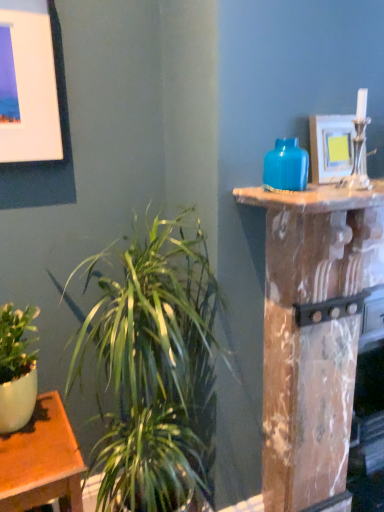
Question: Considering the relative sizes of matte white picture frame at upper left, the first picture frame from the left, and matte blue vase at upper right in the image provided, is matte white picture frame at upper left, the first picture frame from the left, shorter than matte blue vase at upper right?

Choices:
 (A) no
 (B) yes

Answer: (A)

Question: Considering the relative sizes of matte white picture frame at upper left, the first picture frame from the left, and matte blue vase at upper right in the image provided, is matte white picture frame at upper left, the first picture frame from the left, wider than matte blue vase at upper right?

Choices:
 (A) no
 (B) yes

Answer: (A)

Question: From the image's perspective, is matte white picture frame at upper left, the first picture frame from the left, located above matte blue vase at upper right?

Choices:
 (A) no
 (B) yes

Answer: (B)

Question: Is matte white picture frame at upper left, which is the 2th picture frame in right-to-left order, at the left side of matte blue vase at upper right?

Choices:
 (A) no
 (B) yes

Answer: (B)

Question: Is matte white picture frame at upper left, the first picture frame from the left, beside matte blue vase at upper right?

Choices:
 (A) no
 (B) yes

Answer: (A)

Question: Is matte white picture frame at upper left, the first picture frame from the left, positioned with its back to matte blue vase at upper right?

Choices:
 (A) yes
 (B) no

Answer: (B)

Question: Is matte blue vase at upper right smaller than matte white picture frame at upper right, which is the 2th picture frame in left-to-right order?

Choices:
 (A) yes
 (B) no

Answer: (A)

Question: Is matte blue vase at upper right aimed at matte white picture frame at upper right, the 1th picture frame in the right-to-left sequence?

Choices:
 (A) no
 (B) yes

Answer: (A)

Question: Could matte white picture frame at upper right, which is the 2th picture frame in left-to-right order, be considered to be inside matte blue vase at upper right?

Choices:
 (A) yes
 (B) no

Answer: (B)

Question: Is matte white picture frame at upper right, the 1th picture frame in the right-to-left sequence, at the back of matte blue vase at upper right?

Choices:
 (A) no
 (B) yes

Answer: (A)

Question: From a real-world perspective, is matte blue vase at upper right beneath matte white picture frame at upper right, which is the 2th picture frame in left-to-right order?

Choices:
 (A) yes
 (B) no

Answer: (A)

Question: Can you confirm if matte blue vase at upper right is positioned to the left of matte white picture frame at upper right, the 1th picture frame in the right-to-left sequence?

Choices:
 (A) no
 (B) yes

Answer: (B)

Question: Is matte white picture frame at upper right, the 1th picture frame in the right-to-left sequence, outside of matte blue vase at upper right?

Choices:
 (A) yes
 (B) no

Answer: (A)